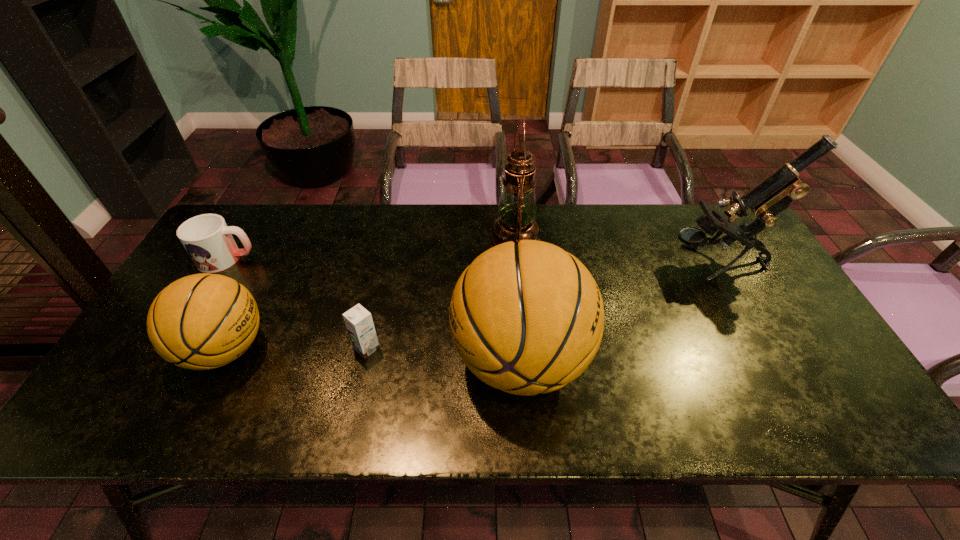
Identify the location of microscope that is at the far edge. (771, 196).

Image resolution: width=960 pixels, height=540 pixels. In order to click on basketball that is at the left edge in this screenshot , I will do click(204, 321).

In order to click on mug that is at the left edge in this screenshot , I will do `click(208, 240)`.

At what (x,y) coordinates should I click in order to perform the action: click on object present at the right edge. Please return your answer as a coordinate pair (x, y). This screenshot has width=960, height=540. Looking at the image, I should click on (771, 196).

Locate an element on the screen. This screenshot has width=960, height=540. object that is at the far left corner is located at coordinates (208, 240).

Locate an element on the screen. The width and height of the screenshot is (960, 540). object that is positioned at the near left corner is located at coordinates (204, 321).

This screenshot has height=540, width=960. I want to click on object that is at the far right corner, so click(x=771, y=196).

Identify the location of free spot at the far edge of the desktop. (595, 205).

Find the location of `free region at the right edge of the desktop`. free region at the right edge of the desktop is located at coordinates (757, 301).

Locate an element on the screen. free space at the near left corner of the desktop is located at coordinates (156, 370).